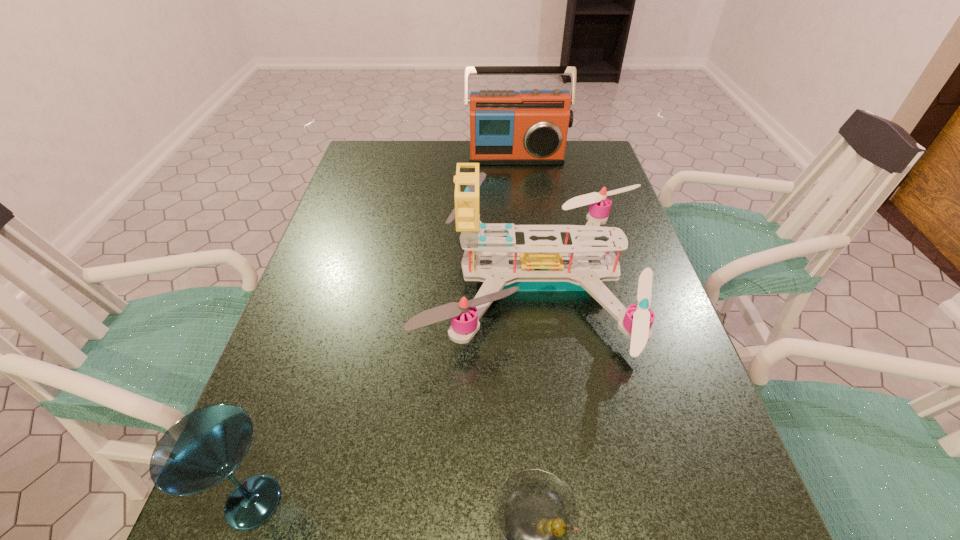
In order to click on radio receiver in this screenshot , I will do `click(528, 127)`.

You are a GUI agent. You are given a task and a screenshot of the screen. Output one action in this format:
    pyautogui.click(x=<x>, y=<y>)
    Task: Click on the drone
    This screenshot has width=960, height=540.
    Given the screenshot: What is the action you would take?
    pyautogui.click(x=540, y=265)

Locate an element on the screen. The width and height of the screenshot is (960, 540). free region located 0.300m on the front-facing side of the radio receiver is located at coordinates (524, 224).

You are a GUI agent. You are given a task and a screenshot of the screen. Output one action in this format:
    pyautogui.click(x=<x>, y=<y>)
    Task: Click on the vacant area situated on the front-facing side of the second farthest object
    The width and height of the screenshot is (960, 540).
    Given the screenshot: What is the action you would take?
    pyautogui.click(x=320, y=281)

Find the location of `blank area located 0.230m on the front-facing side of the second farthest object`. blank area located 0.230m on the front-facing side of the second farthest object is located at coordinates (324, 281).

Where is `vacant space located on the front-facing side of the second farthest object`? vacant space located on the front-facing side of the second farthest object is located at coordinates (345, 281).

Identify the location of object present at the far edge. This screenshot has height=540, width=960. (528, 127).

Identify the location of radio receiver that is at the right edge. (528, 127).

Find the location of a particular element. drone positioned at the right edge is located at coordinates (540, 265).

Locate an element on the screen. This screenshot has height=540, width=960. object that is at the far right corner is located at coordinates (528, 127).